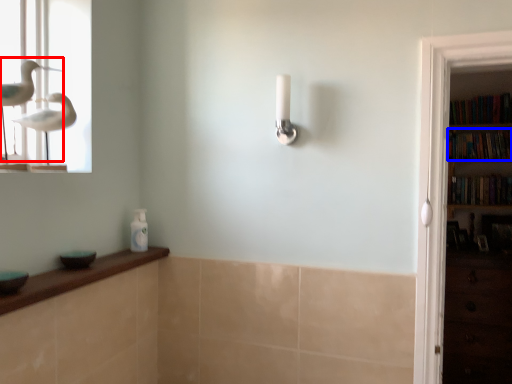
Question: Which point is closer to the camera, bird (highlighted by a red box) or book (highlighted by a blue box)?

Choices:
 (A) bird
 (B) book

Answer: (A)